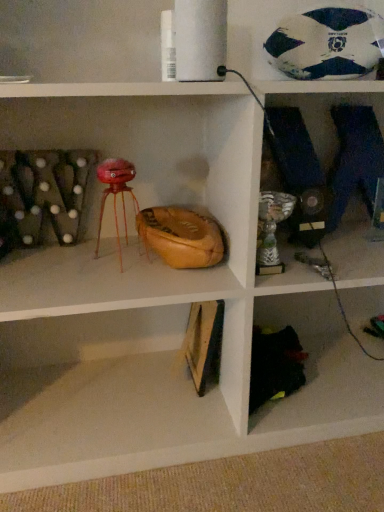
What do you see at coordinates (112, 425) in the screenshot? I see `wooden frame at lower center` at bounding box center [112, 425].

I want to click on wooden frame at lower center, so click(x=112, y=425).

Identify the location of white and blue textured soccer ball at upper right. pyautogui.click(x=327, y=44).

Describe the element at coordinates (327, 44) in the screenshot. The image size is (384, 512). I see `white and blue textured soccer ball at upper right` at that location.

This screenshot has width=384, height=512. Identify the location of wooden frame at lower center. (112, 425).

In the scene shown: Is wooden frame at lower center at the right side of white and blue textured soccer ball at upper right?

No.

Is wooden frame at lower center in front of or behind white and blue textured soccer ball at upper right in the image?

wooden frame at lower center is in front of white and blue textured soccer ball at upper right.

Which point is more distant from viewer, (x=79, y=477) or (x=349, y=39)?

The point (x=79, y=477) is behind.

From the image's perspective, who appears lower, wooden frame at lower center or white and blue textured soccer ball at upper right?

wooden frame at lower center, from the image's perspective.

Based on the photo, from a real-world perspective, which object rests below the other?

From a 3D spatial view, wooden frame at lower center is below.

Between wooden frame at lower center and white and blue textured soccer ball at upper right, which one has larger width?

Wider between the two is wooden frame at lower center.

Who is shorter, wooden frame at lower center or white and blue textured soccer ball at upper right?

wooden frame at lower center.

Is wooden frame at lower center smaller than white and blue textured soccer ball at upper right?

No, wooden frame at lower center is not smaller than white and blue textured soccer ball at upper right.

Can we say wooden frame at lower center lies outside white and blue textured soccer ball at upper right?

Yes.

Is wooden frame at lower center touching white and blue textured soccer ball at upper right?

wooden frame at lower center and white and blue textured soccer ball at upper right are not in contact.

Is wooden frame at lower center facing towards white and blue textured soccer ball at upper right?

No, wooden frame at lower center is not oriented towards white and blue textured soccer ball at upper right.

Measure the distance from wooden frame at lower center to white and blue textured soccer ball at upper right.

A distance of 34.76 inches exists between wooden frame at lower center and white and blue textured soccer ball at upper right.

Locate an element on the screen. shelf below the white and blue textured soccer ball at upper right (from the image's perspective) is located at coordinates (112, 425).

Which is more to the right, white and blue textured soccer ball at upper right or wooden frame at lower center?

white and blue textured soccer ball at upper right.

In the scene shown: Is white and blue textured soccer ball at upper right further to camera compared to wooden frame at lower center?

That is True.

Considering the positions of points (286, 49) and (20, 486), is point (286, 49) farther from camera compared to point (20, 486)?

Yes, point (286, 49) is farther from viewer.

From the image's perspective, is white and blue textured soccer ball at upper right over wooden frame at lower center?

Correct, white and blue textured soccer ball at upper right appears higher than wooden frame at lower center in the image.

From a real-world perspective, between white and blue textured soccer ball at upper right and wooden frame at lower center, who is vertically higher?

white and blue textured soccer ball at upper right, from a real-world perspective.

Which object is thinner, white and blue textured soccer ball at upper right or wooden frame at lower center?

Thinner between the two is white and blue textured soccer ball at upper right.

From the picture: Is white and blue textured soccer ball at upper right taller than wooden frame at lower center?

Yes, white and blue textured soccer ball at upper right is taller than wooden frame at lower center.

Considering the relative sizes of white and blue textured soccer ball at upper right and wooden frame at lower center in the image provided, is white and blue textured soccer ball at upper right bigger than wooden frame at lower center?

Actually, white and blue textured soccer ball at upper right might be smaller than wooden frame at lower center.

Would you say white and blue textured soccer ball at upper right is inside or outside wooden frame at lower center?

white and blue textured soccer ball at upper right is outside wooden frame at lower center.

Are white and blue textured soccer ball at upper right and wooden frame at lower center beside each other?

No, white and blue textured soccer ball at upper right is not in contact with wooden frame at lower center.

Could you tell me if white and blue textured soccer ball at upper right is turned towards wooden frame at lower center?

No.

Consider the image. How different are the orientations of white and blue textured soccer ball at upper right and wooden frame at lower center in degrees?

178 degrees.

This screenshot has height=512, width=384. I want to click on shelf below the white and blue textured soccer ball at upper right (from the image's perspective), so click(x=112, y=425).

You are a GUI agent. You are given a task and a screenshot of the screen. Output one action in this format:
    pyautogui.click(x=<x>, y=<y>)
    Task: Click on the football above the wooden frame at lower center (from the image's perspective)
    
    Given the screenshot: What is the action you would take?
    pyautogui.click(x=327, y=44)

At what (x,y) coordinates should I click in order to perform the action: click on football behind the wooden frame at lower center. Please return your answer as a coordinate pair (x, y). This screenshot has height=512, width=384. Looking at the image, I should click on (327, 44).